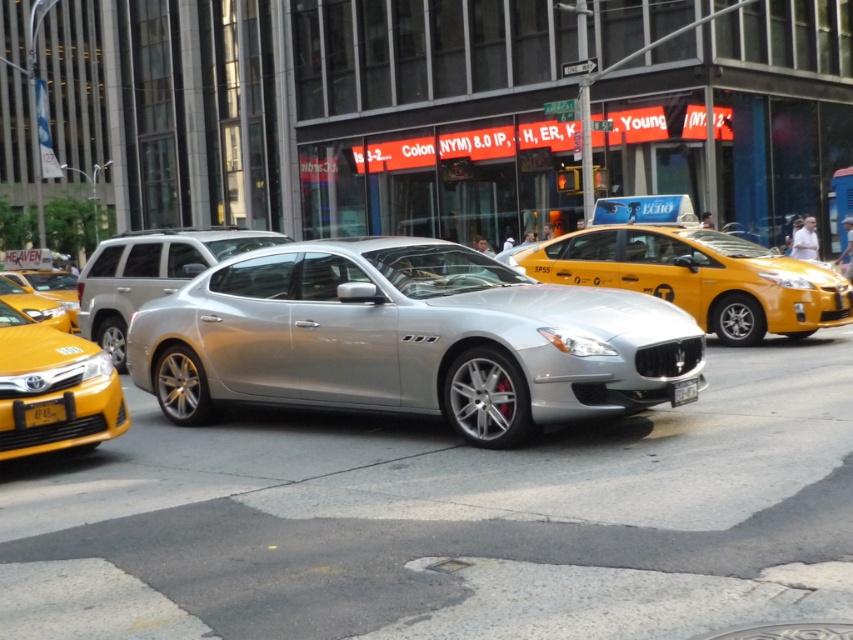
Question: Can you confirm if yellow matte taxi at left is wider than silver metallic sedan at center?

Choices:
 (A) yes
 (B) no

Answer: (B)

Question: Considering the relative positions of yellow glossy taxi at left and black plastic license plate at center in the image provided, where is yellow glossy taxi at left located with respect to black plastic license plate at center?

Choices:
 (A) left
 (B) right

Answer: (A)

Question: Is yellow matte taxi at left closer to camera compared to yellow glossy taxi at left?

Choices:
 (A) yes
 (B) no

Answer: (A)

Question: Estimate the real-world distances between objects in this image. Which object is closer to the yellow matte taxi at center?

Choices:
 (A) black plastic license plate at center
 (B) silver metallic sedan at center
 (C) yellow matte taxi at left

Answer: (A)

Question: Which of the following is the closest to the observer?

Choices:
 (A) black plastic license plate at center
 (B) silver metallic car at center
 (C) yellow matte taxi at center
 (D) yellow glossy taxi at left

Answer: (B)

Question: Which point is farther to the camera?

Choices:
 (A) silver metallic car at center
 (B) yellow matte license plate at lower left
 (C) black plastic license plate at center
 (D) yellow matte taxi at center

Answer: (D)